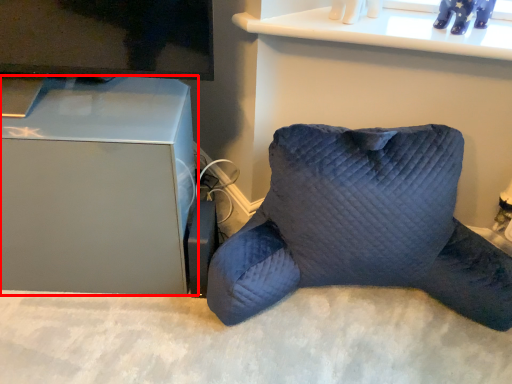
Question: From the image's perspective, what is the correct spatial relationship of furniture (annotated by the red box) in relation to pillow?

Choices:
 (A) above
 (B) below

Answer: (A)